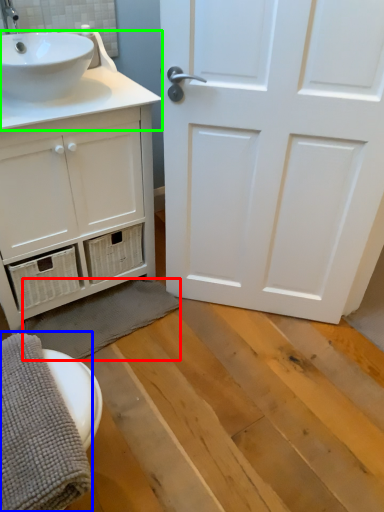
Question: Which is nearer to the bath towel (highlighted by a red box)? bath towel (highlighted by a blue box) or counter top (highlighted by a green box).

Choices:
 (A) bath towel
 (B) counter top

Answer: (A)